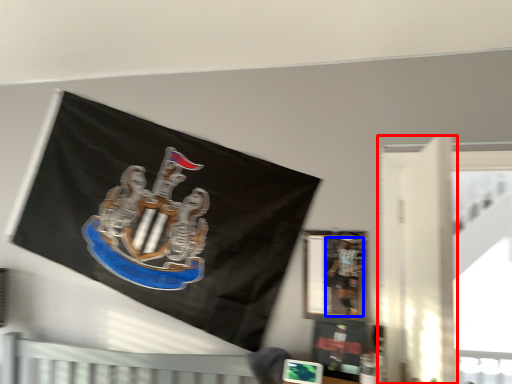
Question: Among these objects, which one is farthest to the camera, door (highlighted by a red box) or person (highlighted by a blue box)?

Choices:
 (A) door
 (B) person

Answer: (B)